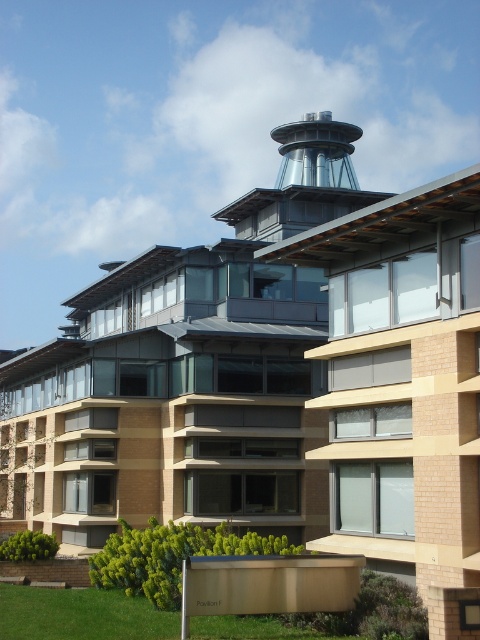
Which is above, metallic glass control tower at upper center or sleek metallic control tower at upper center?

Positioned higher is sleek metallic control tower at upper center.

Does point (269, 224) come farther from viewer compared to point (305, 129)?

No, (269, 224) is closer to viewer.

Who is more distant from viewer, (295,184) or (309,116)?

The point (309,116) is behind.

Identify the location of metallic glass control tower at upper center. This screenshot has width=480, height=640. (302, 180).